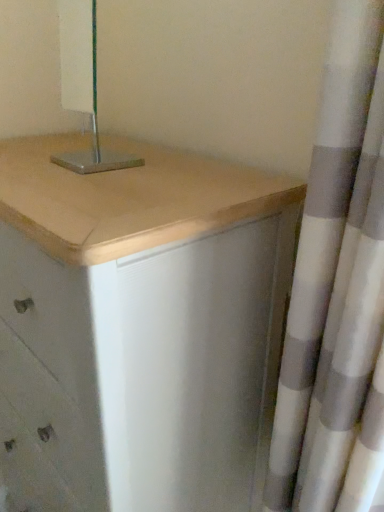
Question: Do you think matte white chest of drawers at center is within metallic silver lamp at upper center, or outside of it?

Choices:
 (A) inside
 (B) outside

Answer: (B)

Question: Considering the positions of matte white chest of drawers at center and metallic silver lamp at upper center in the image, is matte white chest of drawers at center bigger or smaller than metallic silver lamp at upper center?

Choices:
 (A) big
 (B) small

Answer: (A)

Question: Which is nearer to the metallic silver lamp at upper center?

Choices:
 (A) matte white chest of drawers at center
 (B) white textured curtain at right

Answer: (A)

Question: Based on their relative distances, which object is farther from the white textured curtain at right?

Choices:
 (A) metallic silver lamp at upper center
 (B) matte white chest of drawers at center

Answer: (A)